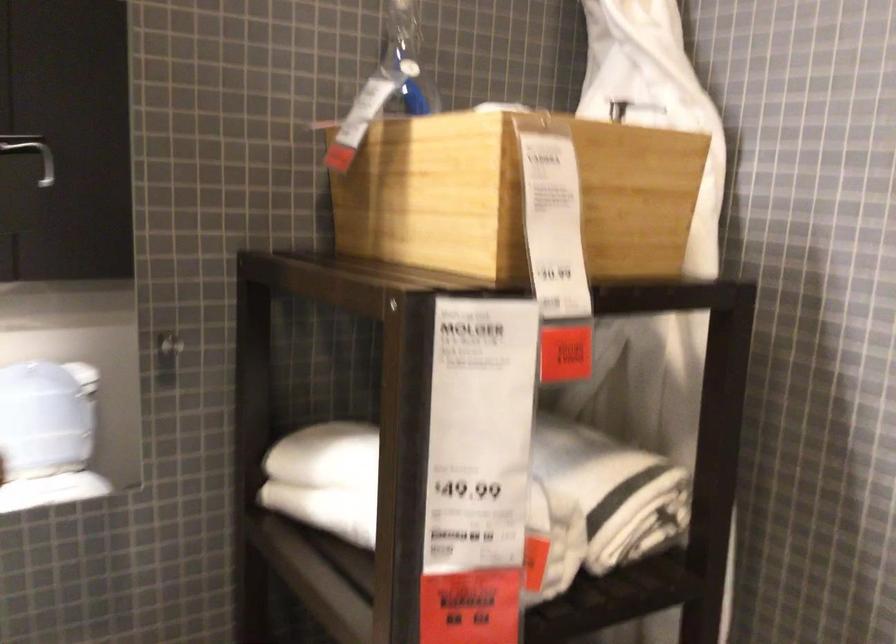
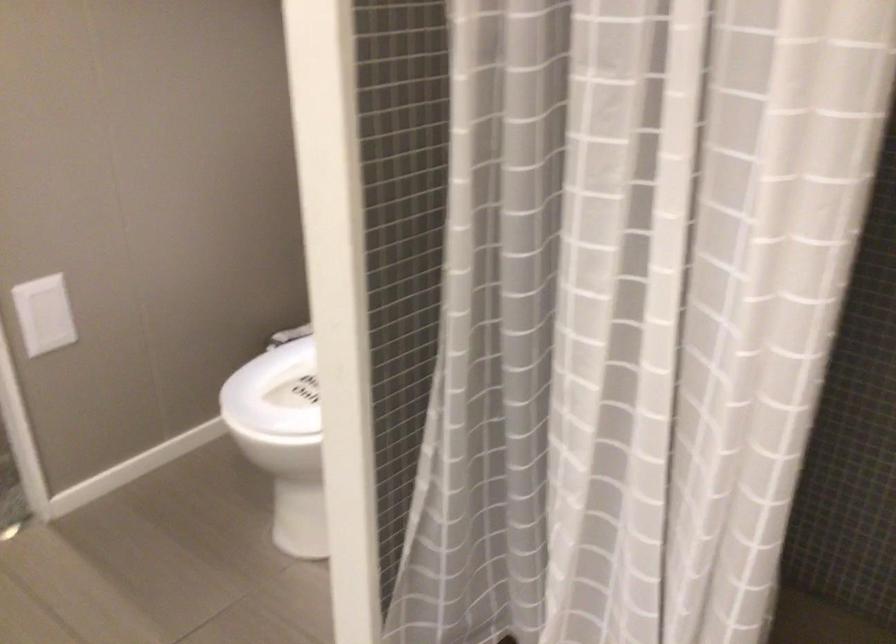
First-person continuous shooting, in which direction is the camera rotating?

The camera's rotation is toward right-down.